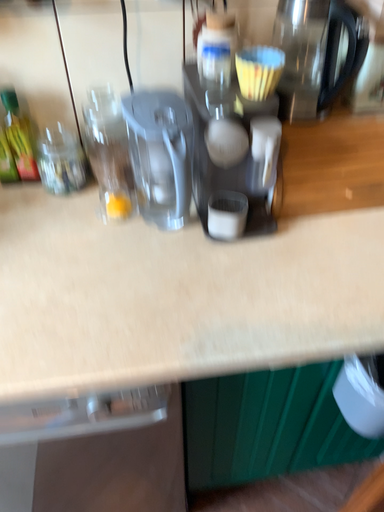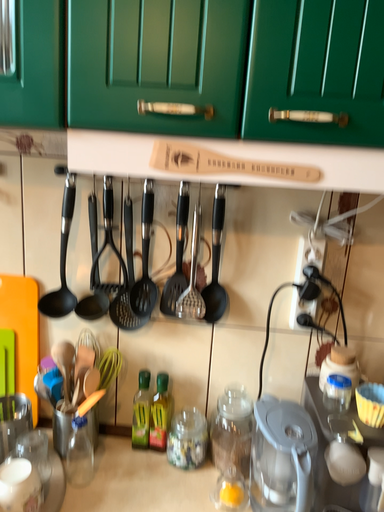
Question: Which way did the camera rotate in the video?

Choices:
 (A) rotated left
 (B) rotated right

Answer: (A)